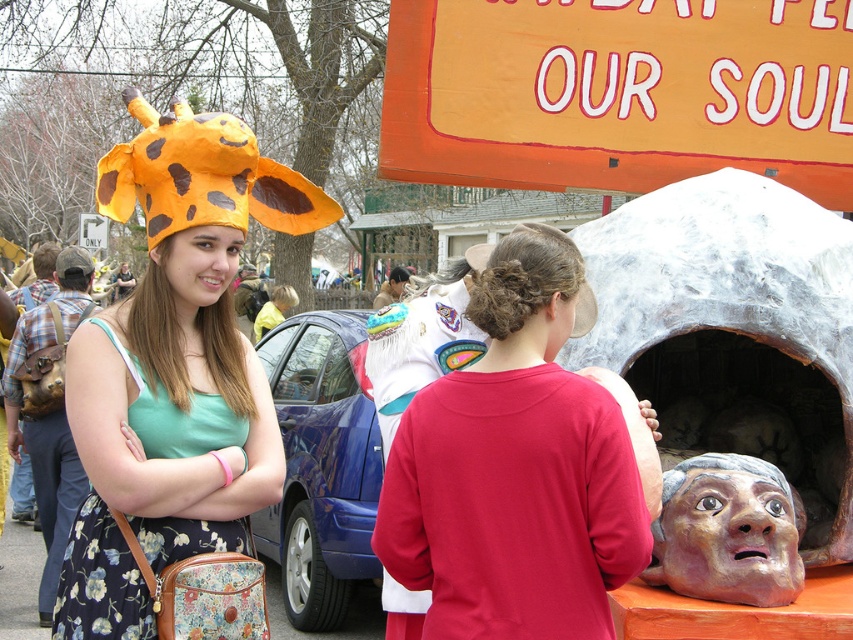
You are a GUI agent. You are given a task and a screenshot of the screen. Output one action in this format:
    pyautogui.click(x=<x>, y=<y>)
    Task: Click on the matte orange paper hat at left
    This screenshot has height=640, width=853.
    Given the screenshot: What is the action you would take?
    pyautogui.click(x=173, y=365)

Is point (187, 188) more distant than point (689, 260)?

No, it is not.

Is point (312, 193) positioned in front of point (459, 289)?

That is True.

At what (x,y) coordinates should I click in order to perform the action: click on matte orange paper hat at left. Please return your answer as a coordinate pair (x, y). Looking at the image, I should click on (173, 365).

Can you confirm if gray stone mask at center is thinner than matte gray stone head at center?

Incorrect, gray stone mask at center's width is not less than matte gray stone head at center's.

Which is in front, point (703, 188) or point (672, 477)?

Point (672, 477)

Find the location of a particular element. Image resolution: width=853 pixels, height=640 pixels. gray stone mask at center is located at coordinates (718, 275).

Can you confirm if orange painted wood sign at upper center is positioned to the left of gray stone mask at center?

Yes, orange painted wood sign at upper center is to the left of gray stone mask at center.

The width and height of the screenshot is (853, 640). Identify the location of orange painted wood sign at upper center. (619, 92).